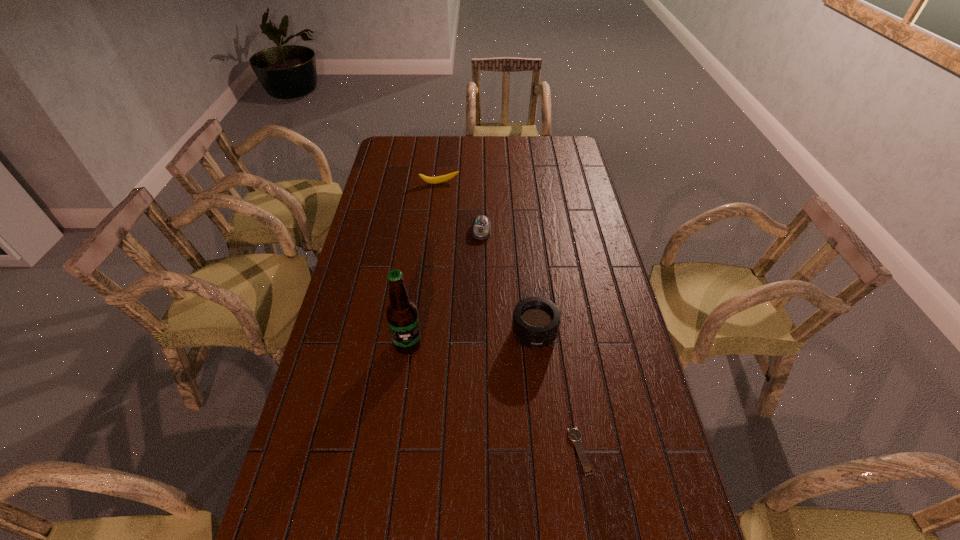
This screenshot has width=960, height=540. I want to click on free region located on the upward curve of the banana, so click(x=444, y=193).

You are a GUI agent. You are given a task and a screenshot of the screen. Output one action in this format:
    pyautogui.click(x=<x>, y=<y>)
    Task: Click on the vacant area situated on the upward curve of the banana
    This screenshot has width=960, height=540.
    Given the screenshot: What is the action you would take?
    pyautogui.click(x=454, y=232)

At what (x,y) coordinates should I click in order to perform the action: click on vacant space located on the upward curve of the banana. Please return your answer as a coordinate pair (x, y). Looking at the image, I should click on (448, 208).

In order to click on vacant space located on the side of the second tallest object with brand markings and control switches in this screenshot , I will do `click(468, 412)`.

You are a GUI agent. You are given a task and a screenshot of the screen. Output one action in this format:
    pyautogui.click(x=<x>, y=<y>)
    Task: Click on the free space located on the side of the second tallest object with brand markings and control switches
    
    Given the screenshot: What is the action you would take?
    [x=494, y=381]

The height and width of the screenshot is (540, 960). What are the coordinates of `vacant space located 0.360m on the side of the second tallest object with brand markings and control switches` in the screenshot? It's located at pyautogui.click(x=444, y=441).

Locate an element on the screen. free location located on the wheel side of the second farthest object is located at coordinates (476, 301).

What are the coordinates of `free space located on the wheel side of the second farthest object` in the screenshot? It's located at (476, 308).

The height and width of the screenshot is (540, 960). I want to click on free spot located 0.390m on the wheel side of the second farthest object, so click(x=475, y=323).

The image size is (960, 540). In order to click on blank space at the far edge of the desktop in this screenshot , I will do `click(472, 139)`.